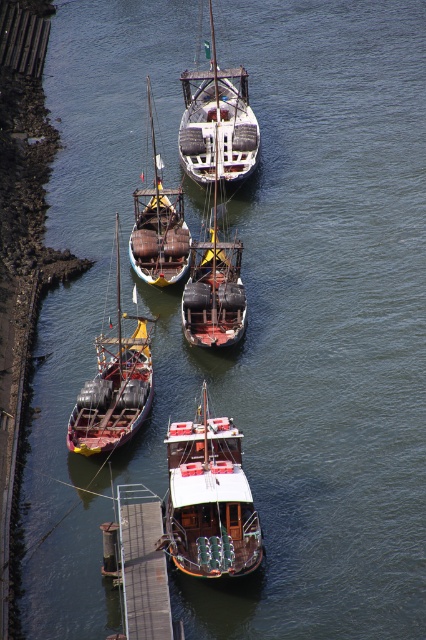
Question: Which of the following is the farthest from the observer?

Choices:
 (A) wooden barrel boat at left
 (B) white matte sailboat at center

Answer: (B)

Question: Is wooden barrel boat at left above rusty wooden boat at center?

Choices:
 (A) no
 (B) yes

Answer: (A)

Question: Is wooden polished boat at center below wooden dock at lower center?

Choices:
 (A) yes
 (B) no

Answer: (B)

Question: Based on their relative distances, which object is nearer to the white matte sailboat at center?

Choices:
 (A) wooden polished boat at center
 (B) wooden dock at lower center

Answer: (A)

Question: Can you confirm if white matte sailboat at center is positioned to the right of wooden barrel boat at left?

Choices:
 (A) yes
 (B) no

Answer: (A)

Question: Among these objects, which one is nearest to the camera?

Choices:
 (A) wooden barrel boat at left
 (B) white matte sailboat at center
 (C) wooden dock at lower center
 (D) rusty wooden boat at center

Answer: (C)